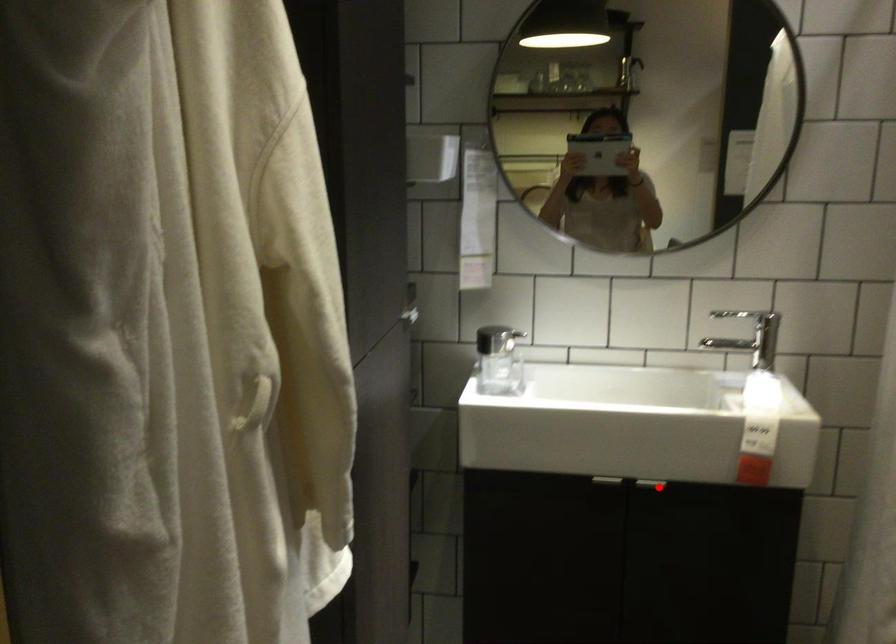
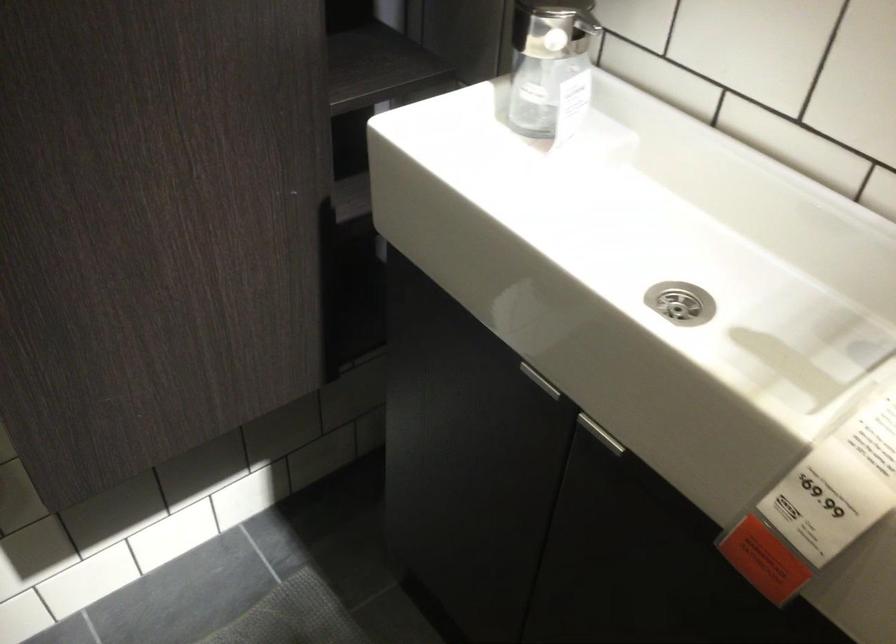
Question: I am providing you with two images of the same scene from different viewpoints. Image1 has a red point marked. In image2, the corresponding 3D location appears at what relative position? Reply with the corresponding letter.

Choices:
 (A) Closer
 (B) Farther

Answer: (A)